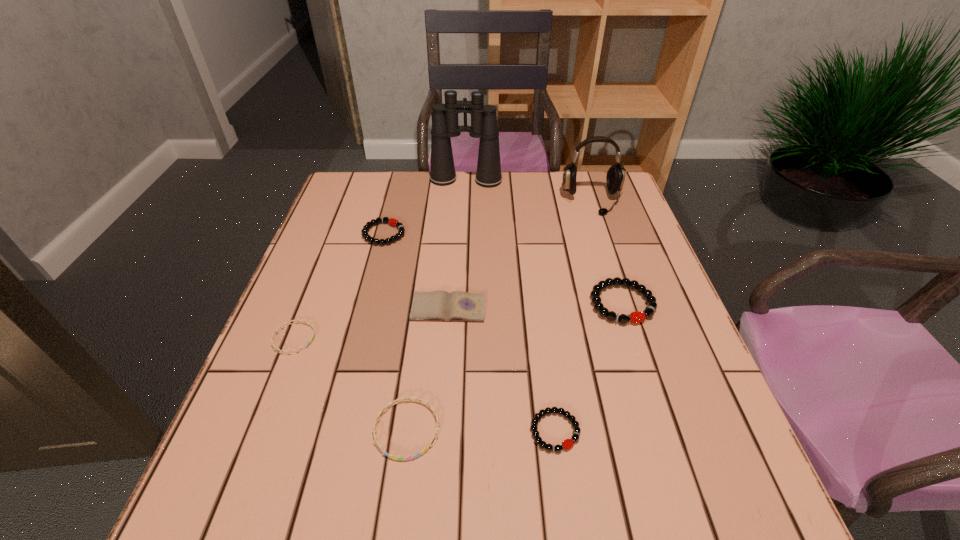
Identify the location of the smallest black bracelet. (568, 443).

The height and width of the screenshot is (540, 960). I want to click on the shortest object, so [x=296, y=321].

The image size is (960, 540). Identify the location of the left blue bracelet. (296, 321).

I want to click on blank space located 0.210m on the front of the tallest object, so click(464, 228).

Where is `vacant space positioned with the microphone on the side of the seventh shortest object`? This screenshot has width=960, height=540. vacant space positioned with the microphone on the side of the seventh shortest object is located at coordinates (613, 265).

Where is `free spot located on the left of the rightmost black bracelet`? This screenshot has width=960, height=540. free spot located on the left of the rightmost black bracelet is located at coordinates (447, 303).

Locate an element on the screen. The image size is (960, 540). vacant position located 0.090m on the front of the leftmost black bracelet is located at coordinates (374, 270).

The width and height of the screenshot is (960, 540). I want to click on blank space located on the back of the diary, so click(x=453, y=247).

The width and height of the screenshot is (960, 540). In order to click on blank area located 0.090m on the surface of the third bracelet from left to right showing star-shaped elements in this screenshot , I will do `click(396, 519)`.

In order to click on free space located 0.120m on the right of the sixth object from left to right in this screenshot , I will do `click(647, 431)`.